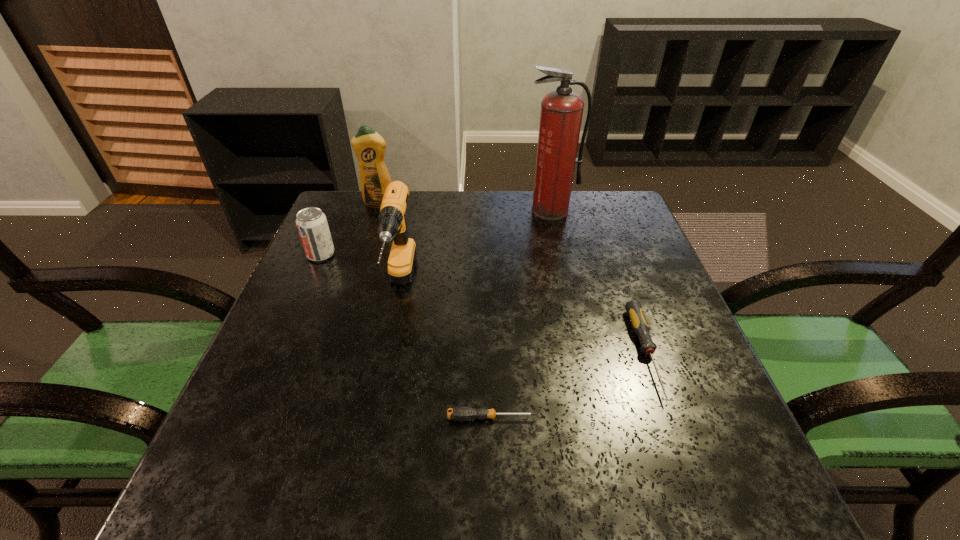
This screenshot has width=960, height=540. I want to click on vacant area located 0.170m at the nozzle of the second object from right to left, so click(x=562, y=258).

Find the location of a particular element. free space located 0.380m on the label of the fifth object from right to left is located at coordinates (348, 299).

What are the coordinates of `free spot located at the tip of the drill` in the screenshot? It's located at (377, 402).

The height and width of the screenshot is (540, 960). I want to click on vacant space situated 0.120m on the back of the leftmost object, so click(336, 221).

Locate an element on the screen. The image size is (960, 540). vacant space located insert the right screwdriver into a screw head is located at coordinates (692, 480).

I want to click on vacant space located on the right of the nearest object, so click(x=678, y=418).

What are the coordinates of `fire extinguisher that is at the far edge` in the screenshot? It's located at (561, 113).

Find the location of `detergent that is at the far edge`. detergent that is at the far edge is located at coordinates (369, 147).

Identify the location of detergent present at the left edge. (369, 147).

Where is `soda can present at the left edge`? soda can present at the left edge is located at coordinates (312, 225).